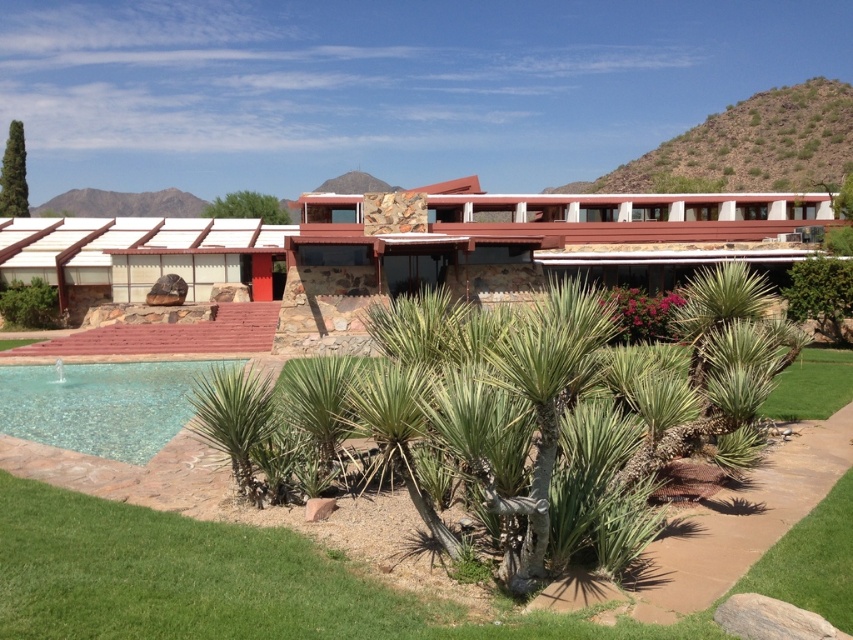
Question: Which of the following is the farthest from the observer?

Choices:
 (A) (20, 202)
 (B) (587, 346)

Answer: (A)

Question: Among these objects, which one is nearest to the camera?

Choices:
 (A) green spiky palm tree at center
 (B) green leafy tree at upper left
 (C) green spiky palm tree at lower center

Answer: (A)

Question: Among these objects, which one is nearest to the camera?

Choices:
 (A) green spiky palm tree at lower center
 (B) blue mosaic tiles at lower left

Answer: (A)

Question: Does green spiky palm tree at lower center appear under green leafy tree at upper left?

Choices:
 (A) yes
 (B) no

Answer: (A)

Question: Is blue mosaic tiles at lower left bigger than green leafy tree at upper left?

Choices:
 (A) yes
 (B) no

Answer: (B)

Question: Is green leafy tree at upper left wider than green leafy tree at upper center?

Choices:
 (A) yes
 (B) no

Answer: (B)